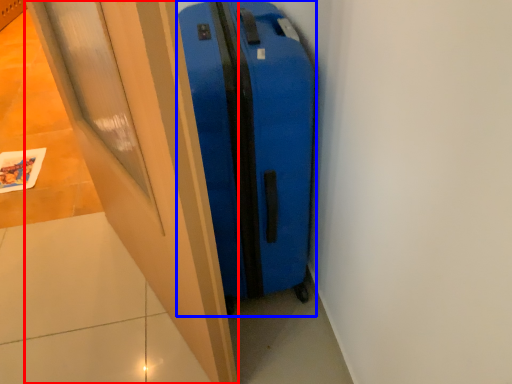
Question: Among these objects, which one is farthest to the camera, door (highlighted by a red box) or suitcase (highlighted by a blue box)?

Choices:
 (A) door
 (B) suitcase

Answer: (B)